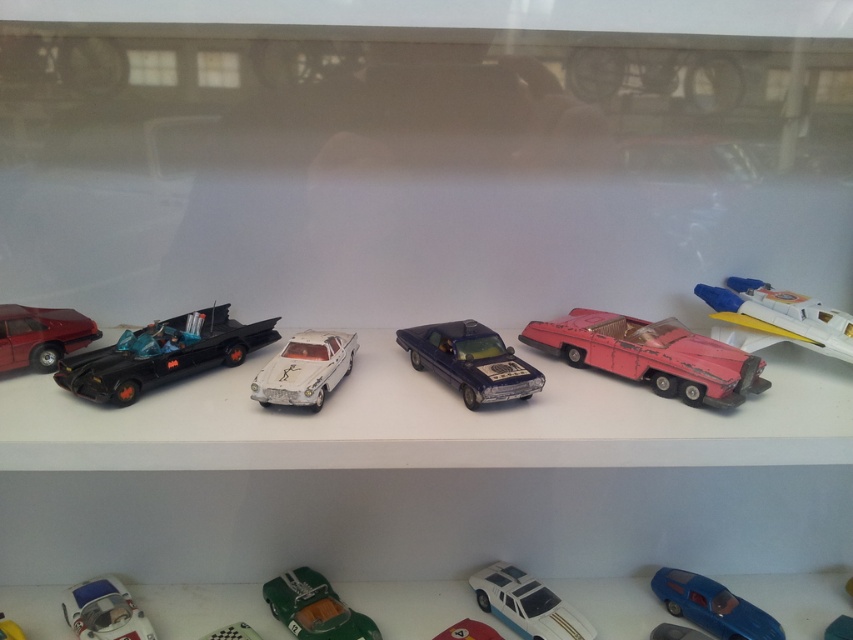
Question: Is blue glossy car at lower right positioned at the back of yellow matte toy car at lower left?

Choices:
 (A) yes
 (B) no

Answer: (A)

Question: Based on their relative distances, which object is nearer to the green glossy toy car at center?

Choices:
 (A) pink matte toy car at center-right
 (B) yellow matte toy car at lower left
 (C) metallic black car at center

Answer: (B)

Question: Which of the following is the closest to the observer?

Choices:
 (A) (596, 320)
 (B) (7, 625)
 (C) (50, 308)
 (D) (506, 609)

Answer: (A)

Question: Is shiny dark blue car at center wider than green glossy toy car at center?

Choices:
 (A) yes
 (B) no

Answer: (B)

Question: Which object is positioned farthest from the white matte toy car at center?

Choices:
 (A) shiny red car at left
 (B) shiny dark blue car at center
 (C) shiny red car at center
 (D) green glossy toy car at center

Answer: (C)

Question: Does pink matte toy car at center-right appear on the left side of shiny red car at left?

Choices:
 (A) no
 (B) yes

Answer: (A)